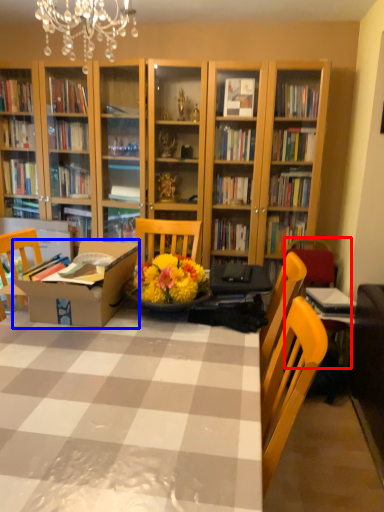
Question: Which object is further to the camera taking this photo, armchair (highlighted by a red box) or cardboard box (highlighted by a blue box)?

Choices:
 (A) armchair
 (B) cardboard box

Answer: (A)